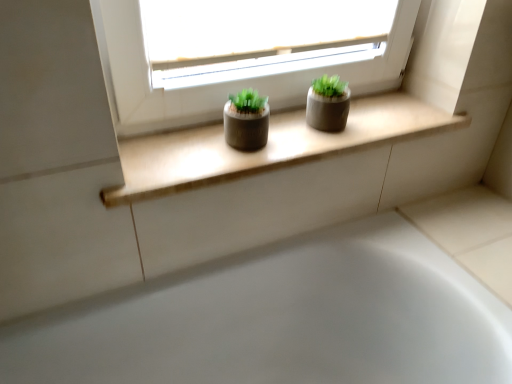
Find the location of `vacant space situated above matte concrete window sill at center (from a real-world perspective)`. vacant space situated above matte concrete window sill at center (from a real-world perspective) is located at coordinates (269, 135).